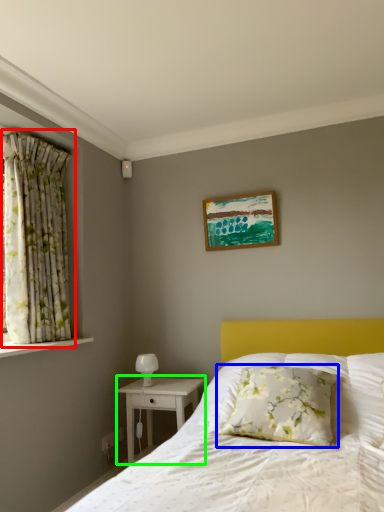
Question: Which object is positioned closest to curtain (highlighted by a red box)? Select from pillow (highlighted by a blue box) and nightstand (highlighted by a green box).

Choices:
 (A) pillow
 (B) nightstand

Answer: (B)